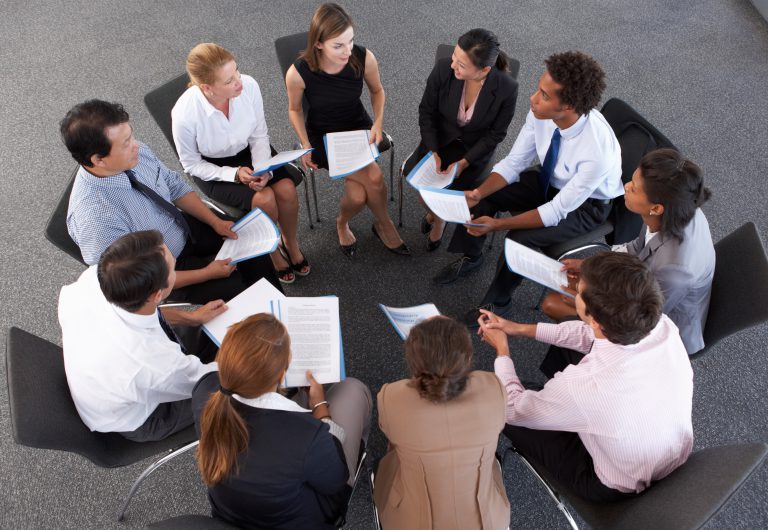
Where is `gray carpet`? The image size is (768, 530). gray carpet is located at coordinates (356, 276), (528, 506), (737, 517), (740, 413), (359, 517), (189, 489), (84, 487), (41, 253), (396, 47).